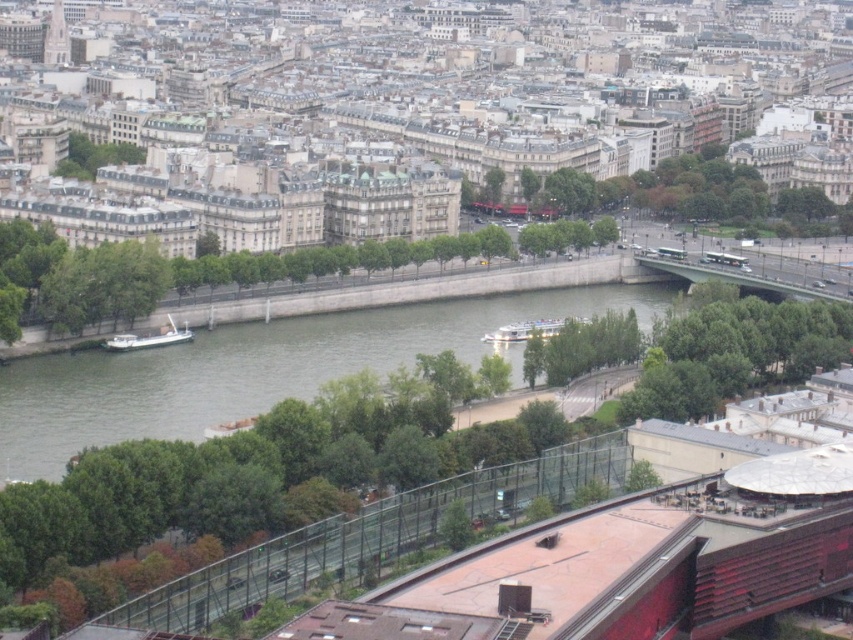
Question: Does green water at center lie behind brushed metal eiffel tower at upper left?

Choices:
 (A) yes
 (B) no

Answer: (B)

Question: Is green water at center positioned behind brushed metal eiffel tower at upper left?

Choices:
 (A) yes
 (B) no

Answer: (B)

Question: Which object appears closest to the camera in this image?

Choices:
 (A) green water at center
 (B) brushed metal eiffel tower at upper left

Answer: (A)

Question: Which object is closer to the camera taking this photo?

Choices:
 (A) green water at center
 (B) brushed metal eiffel tower at upper left

Answer: (A)

Question: Which point is closer to the camera?

Choices:
 (A) (51, 49)
 (B) (125, 397)

Answer: (B)

Question: Is green water at center positioned in front of brushed metal eiffel tower at upper left?

Choices:
 (A) yes
 (B) no

Answer: (A)